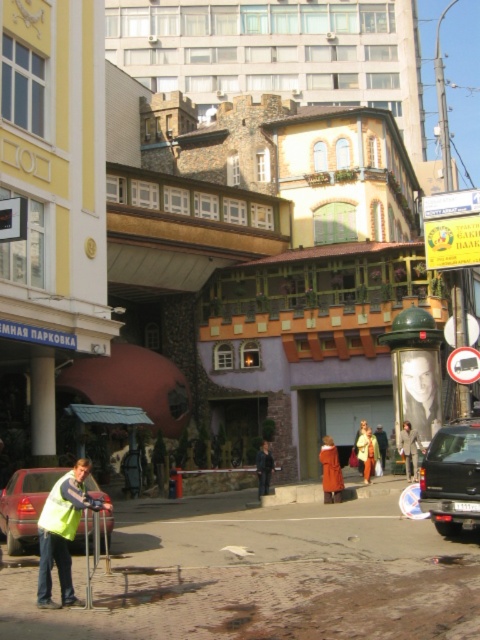
Is matte red car at lower left wider than yellow reflective safety vest at lower left?

Correct, the width of matte red car at lower left exceeds that of yellow reflective safety vest at lower left.

What do you see at coordinates (24, 506) in the screenshot? I see `matte red car at lower left` at bounding box center [24, 506].

Identify the location of matte red car at lower left. (24, 506).

Who is positioned more to the left, black glossy suv at center or yellow reflective safety vest at lower left?

yellow reflective safety vest at lower left is more to the left.

Where is `black glossy suv at center`? This screenshot has width=480, height=640. black glossy suv at center is located at coordinates (452, 477).

Is point (60, 545) farther from viewer compared to point (428, 349)?

No, it is in front of (428, 349).

What do you see at coordinates (62, 532) in the screenshot? I see `yellow reflective vest at lower left` at bounding box center [62, 532].

What do you see at coordinates (62, 532) in the screenshot?
I see `yellow reflective vest at lower left` at bounding box center [62, 532].

Identify the location of yellow reflective vest at lower left. This screenshot has width=480, height=640. (62, 532).